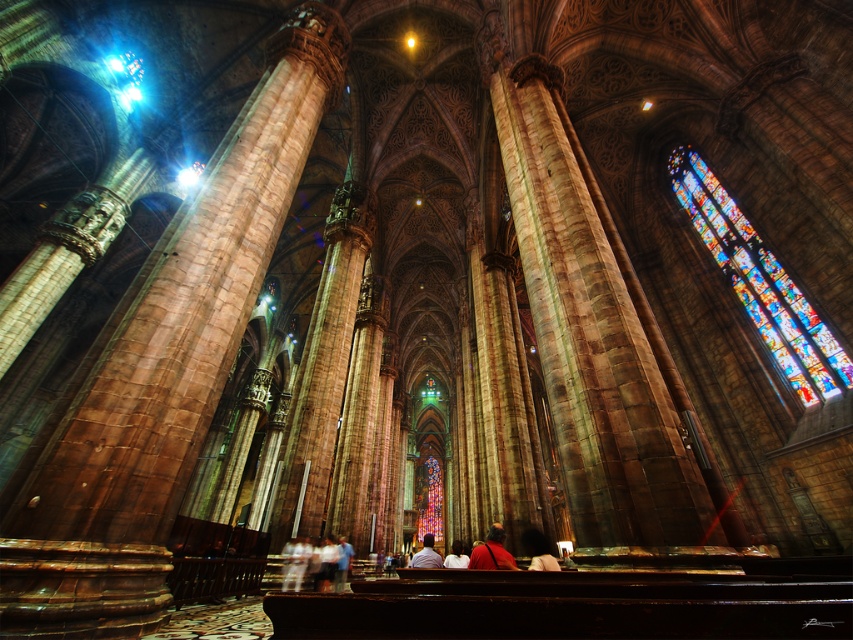
Question: Which object appears farthest from the camera in this image?

Choices:
 (A) smooth skin person at center
 (B) brown stone pillar at center
 (C) stained glass at upper right
 (D) matte red shirt at center

Answer: (A)

Question: Can you confirm if brown stone pillar at left is positioned to the right of light brown leather jacket at center?

Choices:
 (A) yes
 (B) no

Answer: (B)

Question: Which point appears farthest from the camera in this image?

Choices:
 (A) (421, 554)
 (B) (817, 321)
 (C) (631, 326)
 (D) (531, 564)

Answer: (A)

Question: Which of the following is the closest to the observer?

Choices:
 (A) (553, 570)
 (B) (666, 518)
 (C) (805, 378)

Answer: (B)

Question: Observing the image, what is the correct spatial positioning of brown stone pillar at center in reference to stained glass at upper right?

Choices:
 (A) above
 (B) below

Answer: (B)

Question: Is stained glass at upper right bigger than matte red shirt at center?

Choices:
 (A) yes
 (B) no

Answer: (A)